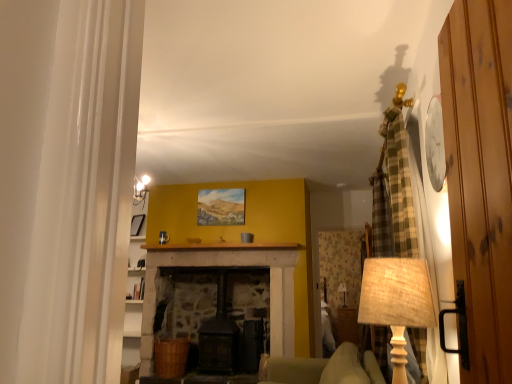
Question: From a real-world perspective, relative to wooden door at right, is matte beige lampshade at center, positioned as the 2th table lamp in top-to-bottom order, vertically above or below?

Choices:
 (A) below
 (B) above

Answer: (A)

Question: Does point (340, 286) appear closer or farther from the camera than point (465, 34)?

Choices:
 (A) farther
 (B) closer

Answer: (A)

Question: Based on their relative distances, which object is nearer to the soft beige fabric armchair at center?

Choices:
 (A) burlap lampshade at right, acting as the second table lamp starting from the back
 (B) matte beige lampshade at center, positioned as the 2th table lamp in top-to-bottom order
 (C) wooden door at right
 (D) matte black picture frame at left

Answer: (B)

Question: Which is nearer to the matte beige lampshade at center, which is the 2th table lamp in left-to-right order?

Choices:
 (A) soft beige fabric armchair at center
 (B) matte black picture frame at left
 (C) wooden door at right
 (D) burlap lampshade at right, which appears as the first table lamp when viewed from the front

Answer: (A)